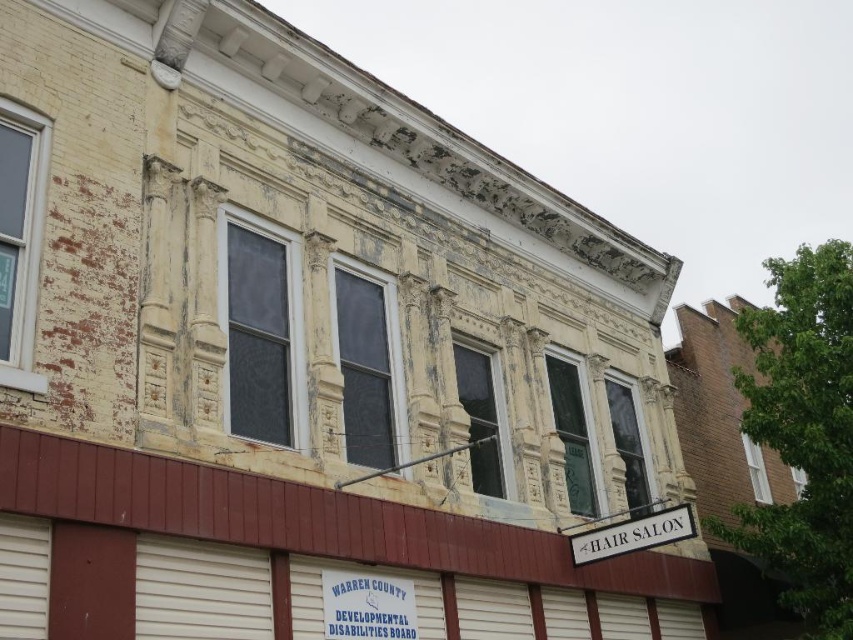
Question: Which point is closer to the camera?

Choices:
 (A) blue plastic sign at lower center
 (B) white plastic hair salon sign at lower right

Answer: (A)

Question: Is blue plastic sign at lower center to the right of white plastic hair salon sign at lower right from the viewer's perspective?

Choices:
 (A) yes
 (B) no

Answer: (B)

Question: Which point is farther from the camera taking this photo?

Choices:
 (A) (347, 632)
 (B) (595, 536)

Answer: (B)

Question: Which point is closer to the camera?

Choices:
 (A) (642, 528)
 (B) (329, 604)

Answer: (B)

Question: Does blue plastic sign at lower center appear on the left side of white plastic hair salon sign at lower right?

Choices:
 (A) no
 (B) yes

Answer: (B)

Question: Is blue plastic sign at lower center to the right of white plastic hair salon sign at lower right from the viewer's perspective?

Choices:
 (A) no
 (B) yes

Answer: (A)